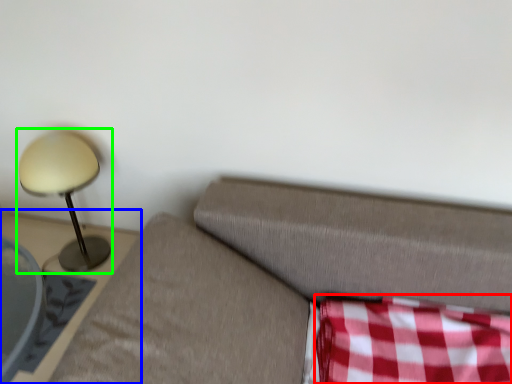
Question: Based on their relative distances, which object is nearer to plaid (highlighted by a red box)? Choose from furniture (highlighted by a blue box) and lamp (highlighted by a green box).

Choices:
 (A) furniture
 (B) lamp

Answer: (A)